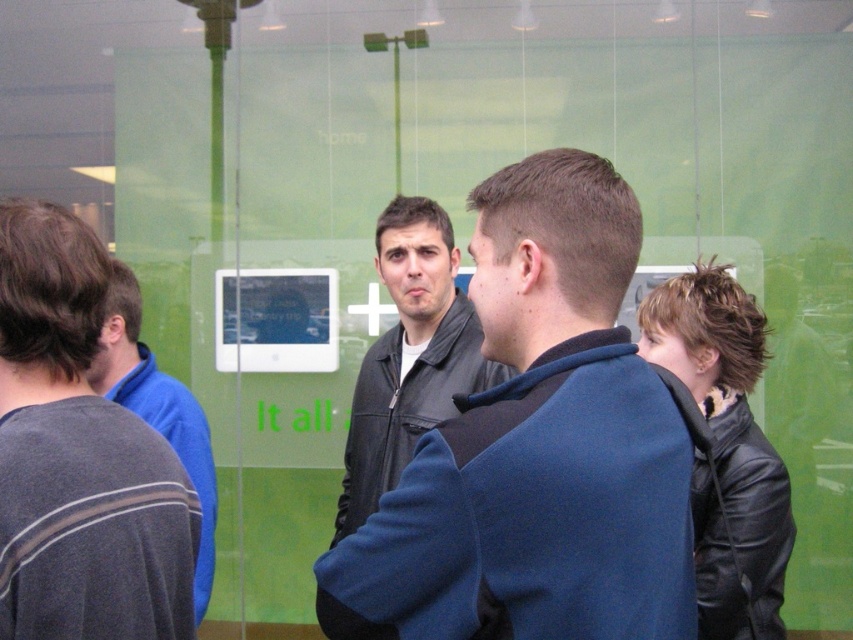
Does leather jacket at center appear on the left side of dark gray sweater at left?

No, leather jacket at center is not to the left of dark gray sweater at left.

Between point (426, 449) and point (119, 596), which one is positioned in front?

Point (426, 449)

The width and height of the screenshot is (853, 640). In order to click on leather jacket at center in this screenshot , I will do `click(537, 448)`.

Is dark gray sweater at left below black leather jacket at lower right?

No, dark gray sweater at left is not below black leather jacket at lower right.

Who is positioned more to the left, dark gray sweater at left or black leather jacket at lower right?

dark gray sweater at left

Which is in front, point (13, 332) or point (753, 552)?

Point (13, 332) is in front.

The height and width of the screenshot is (640, 853). Identify the location of dark gray sweater at left. (78, 458).

Can you confirm if dark gray leather jacket at center is shorter than blue fleece jacket at left?

Correct, dark gray leather jacket at center is not as tall as blue fleece jacket at left.

The width and height of the screenshot is (853, 640). What do you see at coordinates (405, 404) in the screenshot?
I see `dark gray leather jacket at center` at bounding box center [405, 404].

Find the location of a particular element. dark gray leather jacket at center is located at coordinates (405, 404).